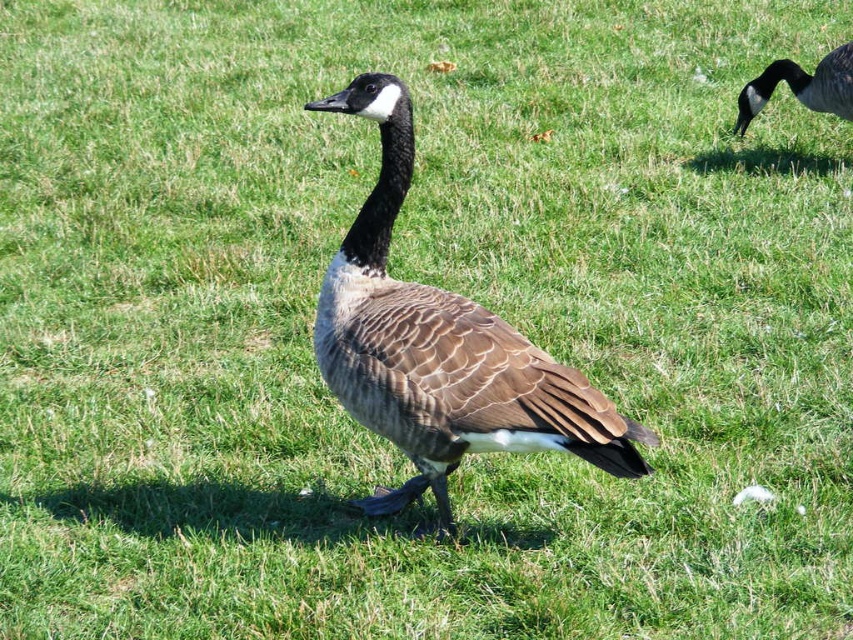
Question: Can you confirm if brown feathered duck at center is smaller than brown feathered goose at upper right?

Choices:
 (A) yes
 (B) no

Answer: (B)

Question: Which point is closer to the camera?

Choices:
 (A) brown feathered goose at upper right
 (B) brown feathered duck at center

Answer: (B)

Question: Does brown feathered duck at center have a smaller size compared to brown feathered goose at upper right?

Choices:
 (A) yes
 (B) no

Answer: (B)

Question: Which of the following is the closest to the observer?

Choices:
 (A) (328, 316)
 (B) (814, 86)

Answer: (A)

Question: Does brown feathered duck at center appear under brown feathered goose at upper right?

Choices:
 (A) yes
 (B) no

Answer: (A)